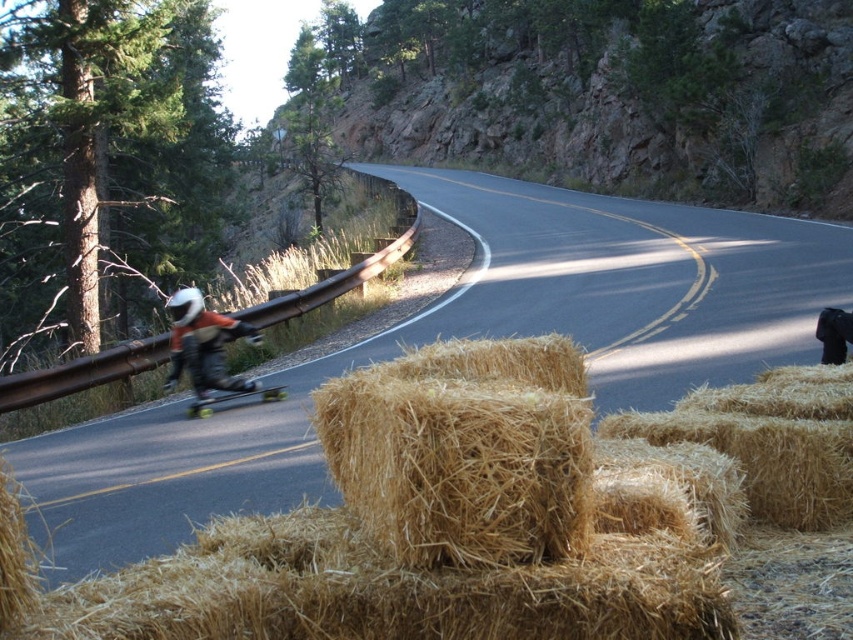
Question: Estimate the real-world distances between objects in this image. Which object is farther from the matte black helmet at left?

Choices:
 (A) brown straw bale at center
 (B) smooth black skateboard at left

Answer: (A)

Question: Among these objects, which one is nearest to the camera?

Choices:
 (A) brown straw bale at center
 (B) smooth black skateboard at left
 (C) golden straw bale at center

Answer: (C)

Question: Is matte black helmet at left positioned before smooth black skateboard at left?

Choices:
 (A) no
 (B) yes

Answer: (A)

Question: Which point is closer to the camera?

Choices:
 (A) brown straw bale at center
 (B) smooth black skateboard at left
 (C) golden straw bale at center
 (D) matte black helmet at left

Answer: (C)

Question: Can you confirm if golden straw bale at center is smaller than smooth black skateboard at left?

Choices:
 (A) yes
 (B) no

Answer: (B)

Question: In this image, where is golden straw bale at center located relative to smooth black skateboard at left?

Choices:
 (A) below
 (B) above

Answer: (B)